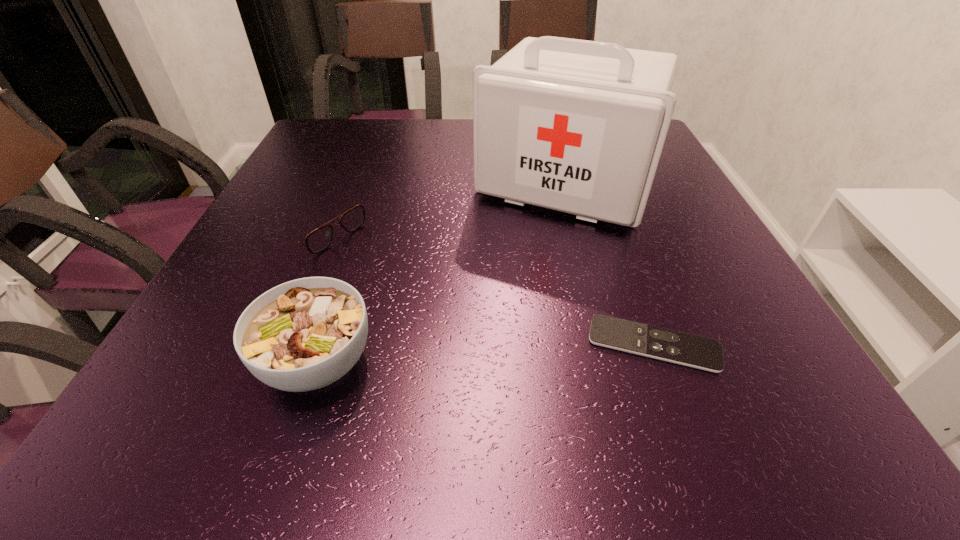
The image size is (960, 540). Find the location of `object at the far right corner`. object at the far right corner is located at coordinates (577, 126).

I want to click on object that is at the near right corner, so (x=704, y=353).

At what (x,y) coordinates should I click in order to perform the action: click on free spot at the far edge of the desktop. Please return your answer as a coordinate pair (x, y). This screenshot has width=960, height=540. Looking at the image, I should click on (444, 132).

This screenshot has height=540, width=960. I want to click on vacant space at the near edge, so click(491, 349).

What are the coordinates of `free region at the left edge of the desktop` in the screenshot? It's located at (255, 235).

This screenshot has width=960, height=540. In the image, there is a desktop. What are the coordinates of `vacant area at the right edge` in the screenshot? It's located at (662, 207).

Image resolution: width=960 pixels, height=540 pixels. In order to click on blank space at the near right corner of the desktop in this screenshot , I will do `click(707, 375)`.

At what (x,y) coordinates should I click in order to perform the action: click on free point between the second shortest object and the first-aid kit. Please return your answer as a coordinate pair (x, y). This screenshot has height=540, width=960. Looking at the image, I should click on (439, 204).

Locate an element on the screen. This screenshot has width=960, height=540. free space between the soup bowl and the tallest object is located at coordinates (442, 272).

The width and height of the screenshot is (960, 540). Identify the location of vacant space that's between the tallest object and the sunglasses. (439, 204).